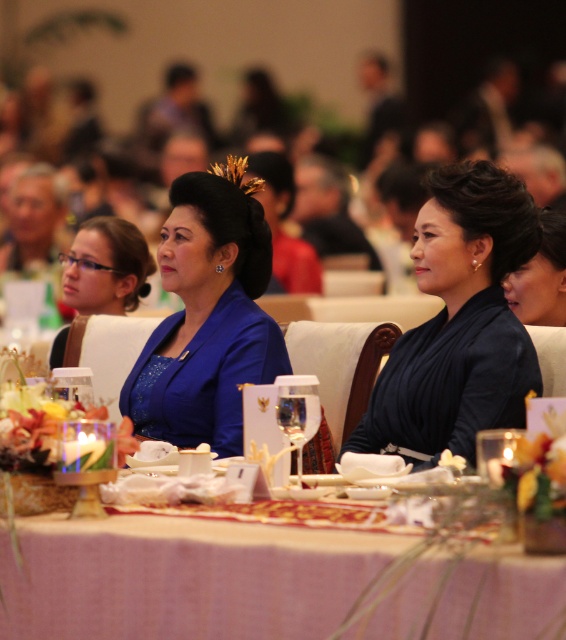
Question: In this image, where is black silk dress at center located relative to blue satin dress at center?

Choices:
 (A) right
 (B) left

Answer: (A)

Question: Which object appears farthest from the camera in this image?

Choices:
 (A) black silk dress at right
 (B) clear glass wine glass at center
 (C) black silk dress at center

Answer: (A)

Question: Can you confirm if pink woven tablecloth at lower center is positioned to the left of black silk dress at center?

Choices:
 (A) yes
 (B) no

Answer: (A)

Question: Can you confirm if matte blue dress at center is positioned below black silk dress at right?

Choices:
 (A) yes
 (B) no

Answer: (A)

Question: Which point is farther to the camera?

Choices:
 (A) (40, 627)
 (B) (139, 246)
 (C) (516, 300)

Answer: (B)

Question: Among these objects, which one is farthest from the camera?

Choices:
 (A) blue satin dress at center
 (B) pink woven tablecloth at lower center

Answer: (A)